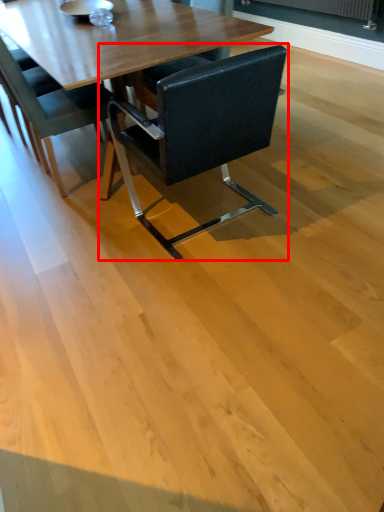
Question: In this image, where is chair (annotated by the red box) located relative to chair?

Choices:
 (A) right
 (B) left

Answer: (A)